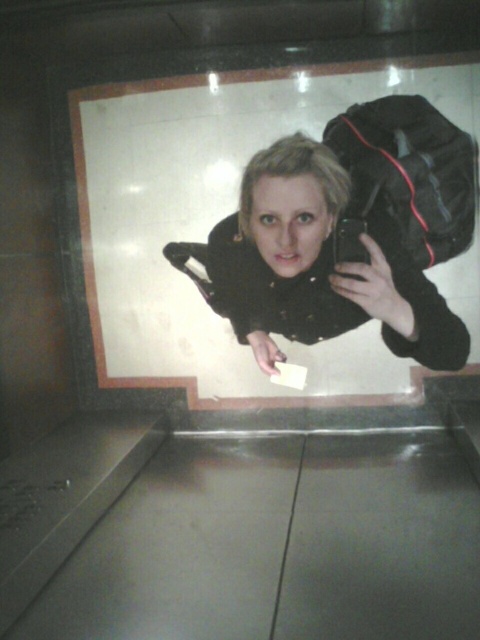
Who is more forward, (x=363, y=291) or (x=394, y=147)?

Positioned in front is point (x=363, y=291).

Looking at this image, is matte black jacket at center taller than black fabric bag at upper right?

Indeed, matte black jacket at center has a greater height compared to black fabric bag at upper right.

This screenshot has height=640, width=480. I want to click on matte black jacket at center, so click(320, 266).

Where is `matte black jacket at center`? This screenshot has width=480, height=640. matte black jacket at center is located at coordinates (320, 266).